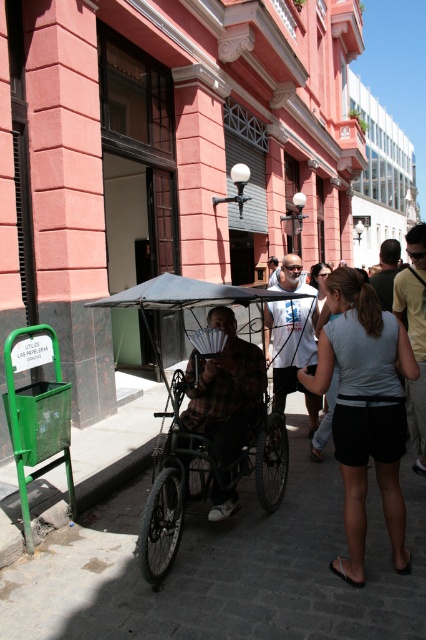
You are a delivery person needing to navigate through the narrow cobblestone street between the black matte wheelchair at center and the white plastic coach at center. Given that your delivery cart is 1.2 meters wide, can you pass through the space between them?

The black matte wheelchair at center is wider than the white plastic coach at center. Therefore, the space between them may be insufficient for your 1.2 meter wide delivery cart to pass through safely.

You are a delivery person who needs to navigate through the narrow cobblestone alley between the black matte wheelchair at center and the plaid fabric cart at center. The alley is only 1.2 meters wide. Can your delivery cart, which is 1 meter wide, pass through safely?

The black matte wheelchair at center might be wider than plaid fabric cart at center. Since the alley is 1.2 meters wide and your cart is 1 meter wide, there might not be enough space if the wheelchair is indeed wider than the cart. It depends on their exact widths, but there is a risk of not fitting.

You are a delivery person trying to maneuver a package from the plaid fabric cart at center to the black matte wheelchair at center. Given that the wheelchair requires a clear path, is there enough space between them to move the package without obstruction?

The black matte wheelchair at center is in front of the plaid fabric cart at center, so there is space between them to move the package without obstruction.